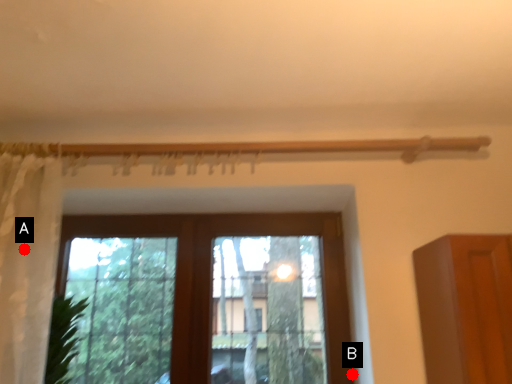
Question: Two points are circled on the image, labeled by A and B beside each circle. Which of the following is the closest to the observer?

Choices:
 (A) A is closer
 (B) B is closer

Answer: (A)